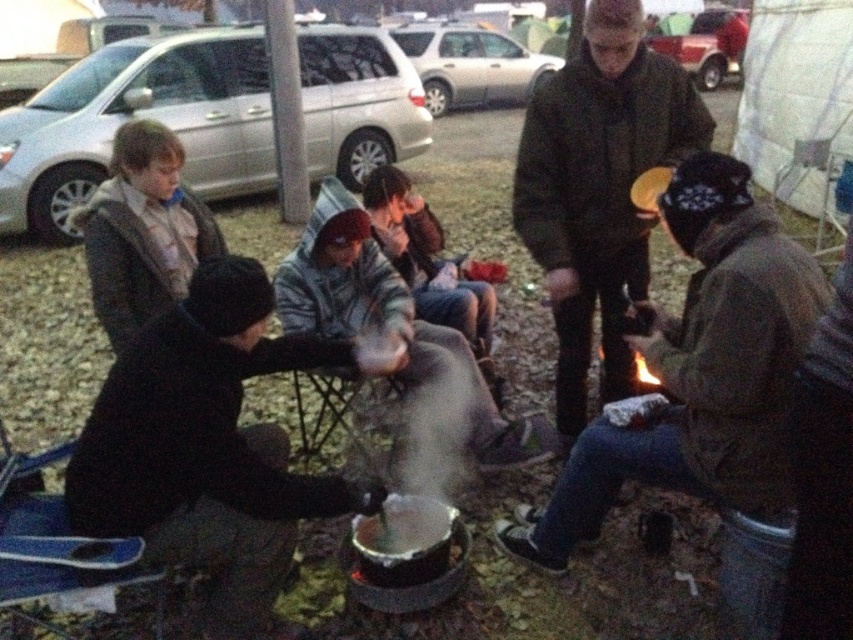
Who is lower down, black matte pot at lower left or dark brown leather jacket at center?

black matte pot at lower left is lower down.

Where is `black matte pot at lower left`? This screenshot has width=853, height=640. black matte pot at lower left is located at coordinates (206, 445).